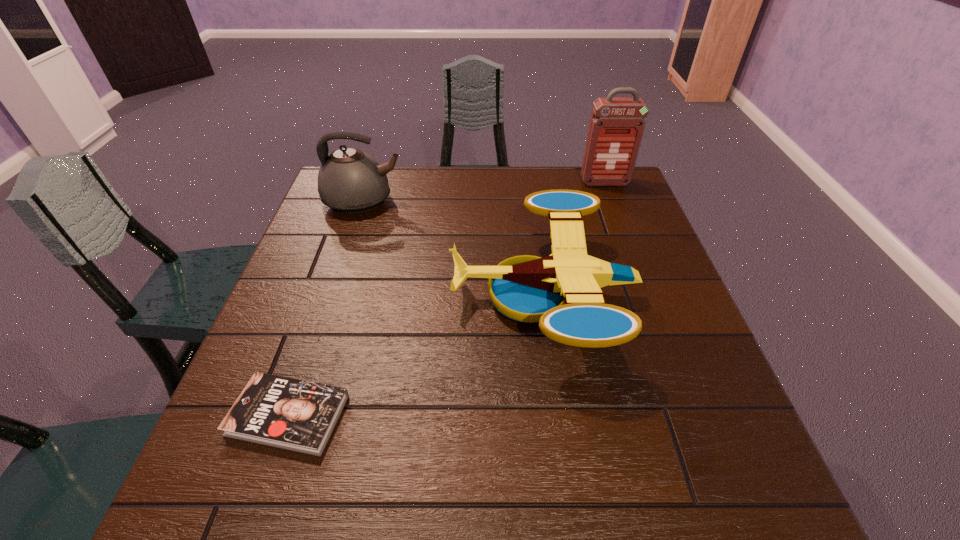
This screenshot has height=540, width=960. What are the coordinates of `the first-aid kit that is at the far edge` in the screenshot? It's located at (616, 128).

Find the location of a particular element. The width and height of the screenshot is (960, 540). kettle that is positioned at the far edge is located at coordinates (350, 181).

In order to click on kettle present at the left edge in this screenshot , I will do pos(350,181).

The height and width of the screenshot is (540, 960). Find the location of `book located at the left edge`. book located at the left edge is located at coordinates (292, 414).

Locate an element on the screen. the first-aid kit that is at the right edge is located at coordinates (616, 128).

You are a GUI agent. You are given a task and a screenshot of the screen. Output one action in this format:
    pyautogui.click(x=<x>, y=<y>)
    Task: Click on the drone that is at the right edge
    
    Given the screenshot: What is the action you would take?
    pyautogui.click(x=562, y=292)

The image size is (960, 540). Identify the location of object at the far left corner. (350, 181).

At what (x,y) coordinates should I click in order to perform the action: click on object that is positioned at the far right corner. Please return your answer as a coordinate pair (x, y). The height and width of the screenshot is (540, 960). Looking at the image, I should click on (616, 128).

In the image, there is a desktop. Identify the location of free space at the far edge. (515, 172).

Where is `free space at the near edge of the desktop`? Image resolution: width=960 pixels, height=540 pixels. free space at the near edge of the desktop is located at coordinates (394, 518).